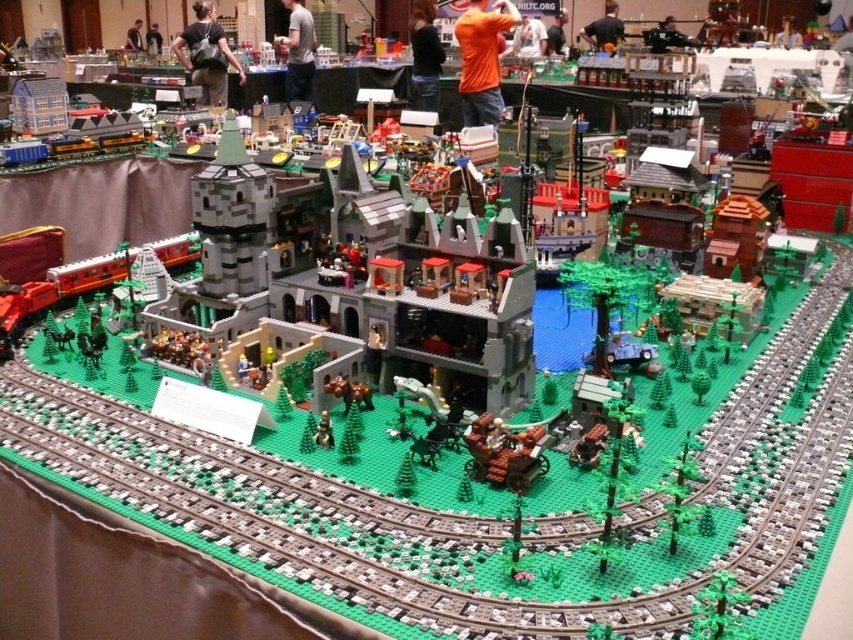
You are a Lego enthusiast attending the convention and notice the smooth gray castle at center and the black leather bag at upper center. From your perspective, which object is positioned higher up in the image?

The black leather bag at upper center is positioned higher up in the image than the smooth gray castle at center.

You are a Lego enthusiast attending the exhibition and want to take a photo of both the orange fabric shirt at center and the matte black shirt at upper center in the same frame. Considering the camera you have can capture a maximum distance of 7 feet between subjects, will you be able to include both shirts in the photo?

The orange fabric shirt at center is 7.69 feet from the matte black shirt at upper center. Since the camera can only capture up to 7 feet between subjects, the shirts are slightly too far apart to fit in the same frame.

From the picture: You are a fashion designer observing the Lego exhibition and notice two items at the center of the scene. You need to determine which item is wider between the black leather jacket at center and the matte black shirt at center. Which one is wider?

The black leather jacket at center is wider than the matte black shirt at center according to the description provided.